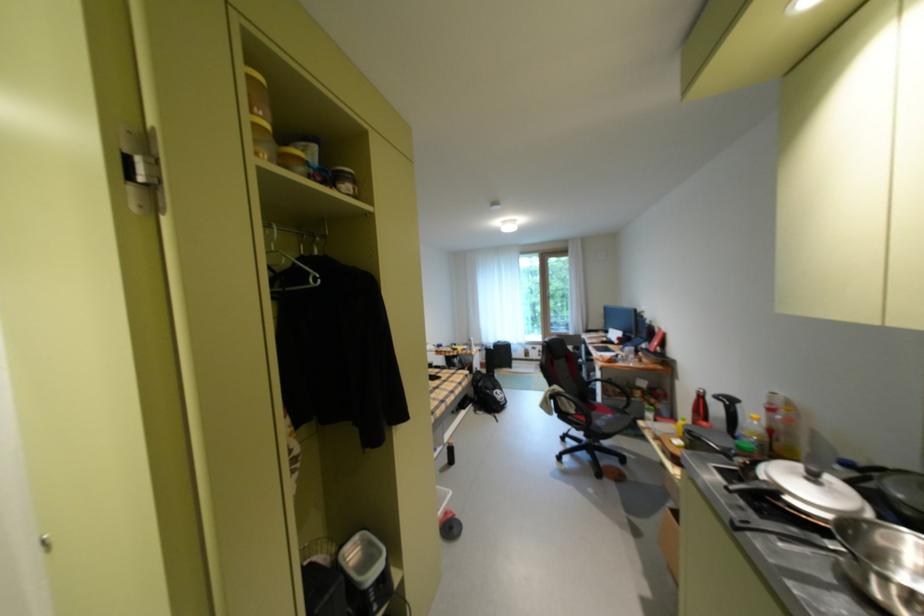
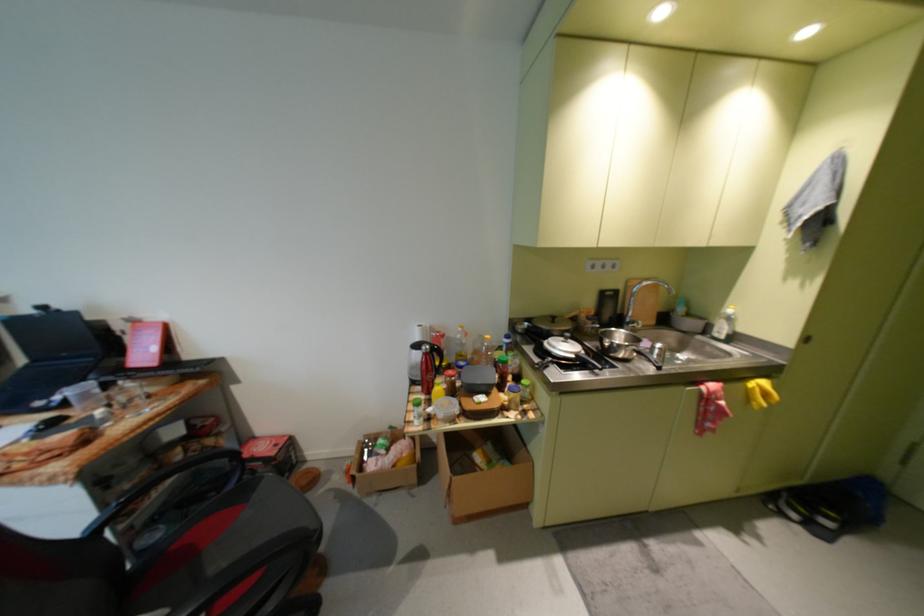
The point at (776, 483) is marked in the first image. Where is the corresponding point in the second image?

(586, 357)